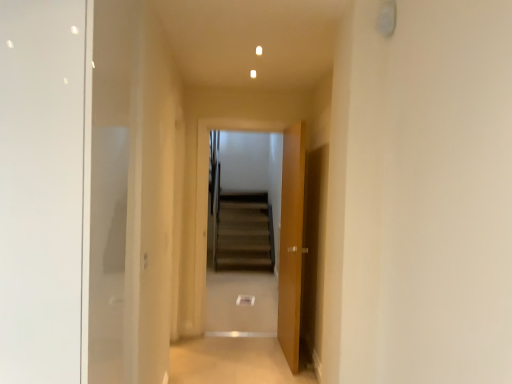
At what (x,y) coordinates should I click in order to perform the action: click on wooden door at center. Please return your answer as a coordinate pair (x, y). The image size is (512, 384). Looking at the image, I should click on (291, 243).

The width and height of the screenshot is (512, 384). What are the coordinates of `beige carpet at center` in the screenshot? It's located at (234, 362).

Is point (216, 137) farther from camera compared to point (294, 307)?

Yes, it is behind point (294, 307).

Does brown carpeted stairs at center have a greater height compared to wooden door at center?

Yes.

Can you tell me how much brown carpeted stairs at center and wooden door at center differ in facing direction?

93.8 degrees separate the facing orientations of brown carpeted stairs at center and wooden door at center.

Does brown carpeted stairs at center come behind wooden door at center?

Yes, brown carpeted stairs at center is behind wooden door at center.

Can beige carpet at center be found inside brown carpeted stairs at center?

Definitely not — beige carpet at center is not inside brown carpeted stairs at center.

Is brown carpeted stairs at center not near beige carpet at center?

Yes, brown carpeted stairs at center and beige carpet at center are located far from each other.

Is brown carpeted stairs at center to the left or to the right of beige carpet at center in the image?

In the image, brown carpeted stairs at center appears on the right side of beige carpet at center.

Which is in front, point (268, 347) or point (237, 196)?

The point (268, 347) is more forward.

Is the depth of beige carpet at center less than that of brown carpeted stairs at center?

Yes, it is in front of brown carpeted stairs at center.

Considering the sizes of objects beige carpet at center and brown carpeted stairs at center in the image provided, who is shorter, beige carpet at center or brown carpeted stairs at center?

beige carpet at center.

Considering the relative sizes of beige carpet at center and brown carpeted stairs at center in the image provided, is beige carpet at center wider than brown carpeted stairs at center?

Correct, the width of beige carpet at center exceeds that of brown carpeted stairs at center.

From a real-world perspective, does wooden door at center sit lower than brown carpeted stairs at center?

Correct, in the physical world, wooden door at center is lower than brown carpeted stairs at center.

Which is behind, point (295, 223) or point (276, 205)?

Positioned behind is point (276, 205).

Can you tell me how much wooden door at center and brown carpeted stairs at center differ in facing direction?

93.8 degrees separate the facing orientations of wooden door at center and brown carpeted stairs at center.

Would you say brown carpeted stairs at center is part of wooden door at center's contents?

No, brown carpeted stairs at center is not inside wooden door at center.

Is beige carpet at center in front of or behind wooden door at center in the image?

beige carpet at center is in front of wooden door at center.

Which is more distant, (174, 382) or (281, 270)?

The point (281, 270) is farther from the camera.

Is beige carpet at center not near wooden door at center?

beige carpet at center is actually quite close to wooden door at center.

In the image, there is a beige carpet at center. Identify the location of door above it (from the image's perspective). (291, 243).

How far apart are wooden door at center and beige carpet at center?

wooden door at center and beige carpet at center are 24.03 inches apart from each other.

Does wooden door at center have a lesser width compared to beige carpet at center?

Yes.

Find the location of a particular element. The width and height of the screenshot is (512, 384). escalator located above the wooden door at center (from a real-world perspective) is located at coordinates (246, 200).

At what (x,y) coordinates should I click in order to perform the action: click on path on the left of brown carpeted stairs at center. Please return your answer as a coordinate pair (x, y). This screenshot has width=512, height=384. Looking at the image, I should click on (234, 362).

Looking at the image, which one is located closer to wooden door at center, brown carpeted stairs at center or beige carpet at center?

beige carpet at center lies closer to wooden door at center than the other object.

Based on their spatial positions, is beige carpet at center or wooden door at center closer to brown carpeted stairs at center?

beige carpet at center is closer to brown carpeted stairs at center.

Based on the photo, when comparing their distances from wooden door at center, does beige carpet at center or brown carpeted stairs at center seem further?

Among the two, brown carpeted stairs at center is located further to wooden door at center.

Looking at this image, based on their spatial positions, is wooden door at center or brown carpeted stairs at center further from beige carpet at center?

Based on the image, brown carpeted stairs at center appears to be further to beige carpet at center.

Based on their spatial positions, is brown carpeted stairs at center or wooden door at center further from beige carpet at center?

brown carpeted stairs at center is positioned further to the anchor beige carpet at center.

Which object lies further to the anchor point brown carpeted stairs at center, wooden door at center or beige carpet at center?

wooden door at center is further to brown carpeted stairs at center.

Find the location of a particular element. This screenshot has width=512, height=384. door between brown carpeted stairs at center and beige carpet at center from top to bottom is located at coordinates (291, 243).